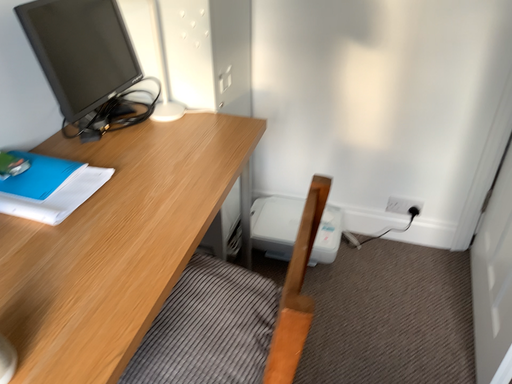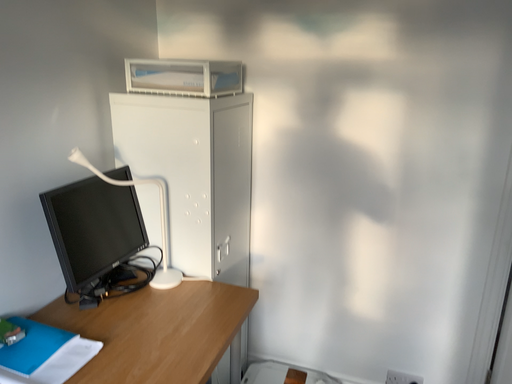
Question: Which way did the camera rotate in the video?

Choices:
 (A) rotated upward
 (B) rotated downward

Answer: (A)